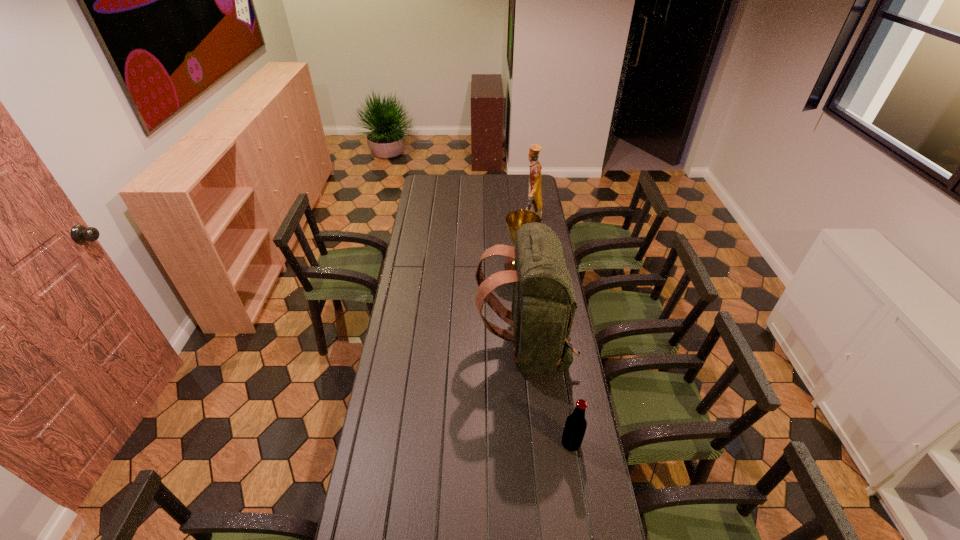
Locate an element on the screen. award that is at the right edge is located at coordinates (515, 219).

At what (x,y) coordinates should I click in order to perform the action: click on beer bottle that is at the right edge. Please return your answer as a coordinate pair (x, y). Looking at the image, I should click on (575, 426).

In the image, there is a desktop. Find the location of `vacant space at the far edge`. vacant space at the far edge is located at coordinates (499, 185).

Locate an element on the screen. The image size is (960, 540). vacant space at the left edge of the desktop is located at coordinates (358, 489).

You are a GUI agent. You are given a task and a screenshot of the screen. Output one action in this format:
    pyautogui.click(x=<x>, y=<y>)
    Task: Click on the blank space at the right edge of the desktop
    
    Given the screenshot: What is the action you would take?
    pyautogui.click(x=555, y=476)

The height and width of the screenshot is (540, 960). Find the location of `vacant space at the far left corner`. vacant space at the far left corner is located at coordinates (445, 174).

The height and width of the screenshot is (540, 960). I want to click on object that is the closest to the third tallest object, so click(x=543, y=307).

Locate an element on the screen. object that is the second closest to the second farthest object is located at coordinates (535, 203).

Where is `blank space that satisfies the following two spatial constraints: 1. on the back of the backpack; 2. on the left side of the shortest object`? Image resolution: width=960 pixels, height=540 pixels. blank space that satisfies the following two spatial constraints: 1. on the back of the backpack; 2. on the left side of the shortest object is located at coordinates (533, 443).

Image resolution: width=960 pixels, height=540 pixels. I want to click on free spot that satisfies the following two spatial constraints: 1. on the back side of the nearest object; 2. on the front-facing side of the farthest object, so click(x=535, y=218).